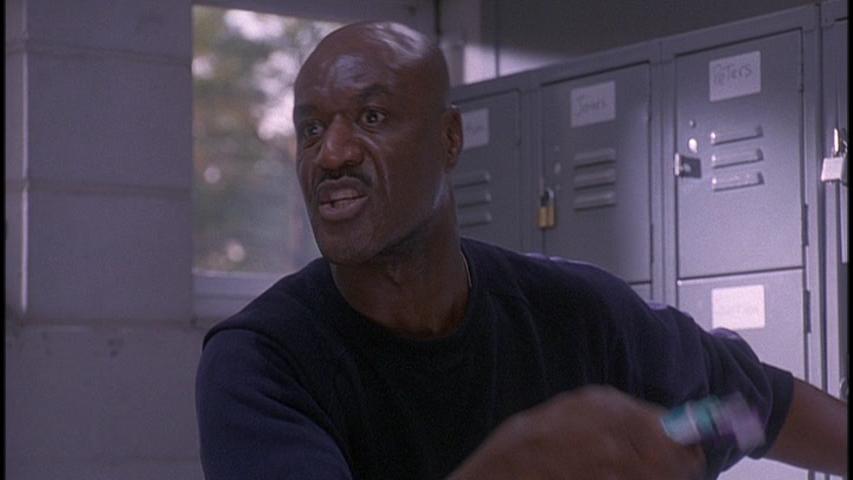
Locate an element on the screen. locker is located at coordinates (680, 213), (612, 226), (477, 198), (776, 309).